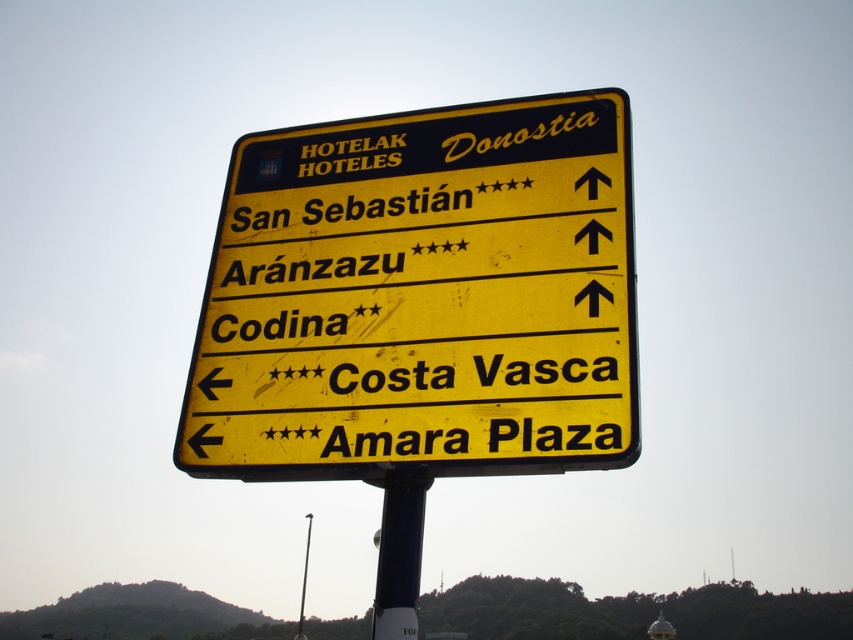
From the picture: You are standing in front of the yellow matte sign at center and want to touch the metallic pole at center. Can you reach it without moving your feet?

The yellow matte sign at center is closer to the viewer than metallic pole at center, so you can reach the metallic pole at center by extending your arm since it is behind the sign but within reach.

You are standing in front of the yellow matte sign at center and the blue metallic pole at center. Which object is taller?

The yellow matte sign at center is much taller than the blue metallic pole at center.